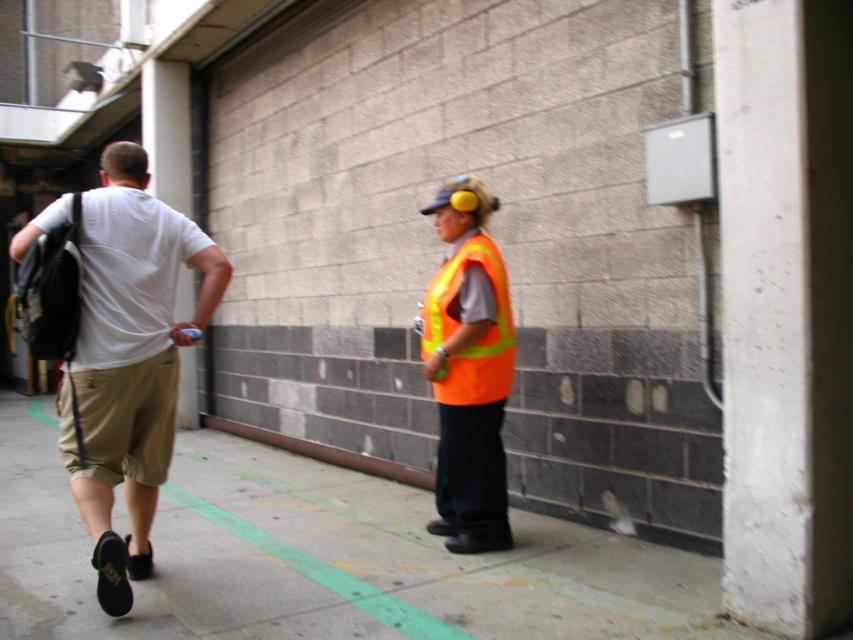
Does concrete sidewalk at center appear over high-visibility reflective vest at center?

Actually, concrete sidewalk at center is below high-visibility reflective vest at center.

Can you confirm if concrete sidewalk at center is wider than high-visibility reflective vest at center?

Yes, concrete sidewalk at center is wider than high-visibility reflective vest at center.

Does point (456, 577) come farther from viewer compared to point (442, 416)?

No, (456, 577) is closer to viewer.

Find the location of a particular element. This screenshot has height=640, width=853. concrete sidewalk at center is located at coordinates (321, 557).

Can you confirm if white cotton t-shirt at left is shorter than khaki cotton shorts at left?

No.

Is point (120, 563) farther from viewer compared to point (173, 368)?

That is False.

Is point (141, 161) behind point (61, 406)?

Yes, point (141, 161) is farther from viewer.

At what (x,y) coordinates should I click in order to perform the action: click on white cotton t-shirt at left. Please return your answer as a coordinate pair (x, y). This screenshot has width=853, height=640. Looking at the image, I should click on (129, 358).

Which of these two, white cotton t-shirt at left or high-visibility orange safety vest at center, stands taller?

With more height is white cotton t-shirt at left.

Is the position of white cotton t-shirt at left less distant than that of high-visibility orange safety vest at center?

Yes, white cotton t-shirt at left is closer to the viewer.

Who is more distant from viewer, (164, 330) or (503, 314)?

Positioned behind is point (503, 314).

Image resolution: width=853 pixels, height=640 pixels. What are the coordinates of `white cotton t-shirt at left` in the screenshot? It's located at (129, 358).